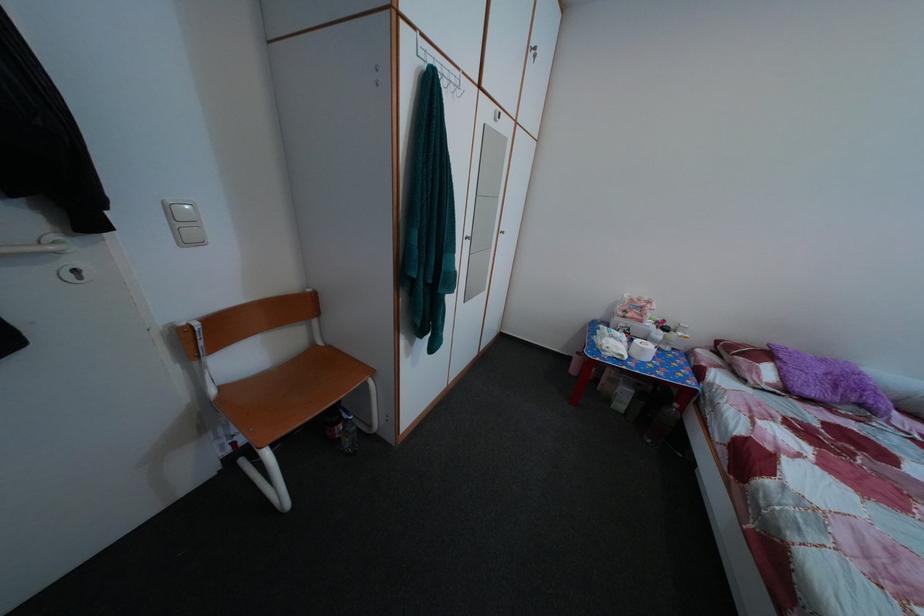
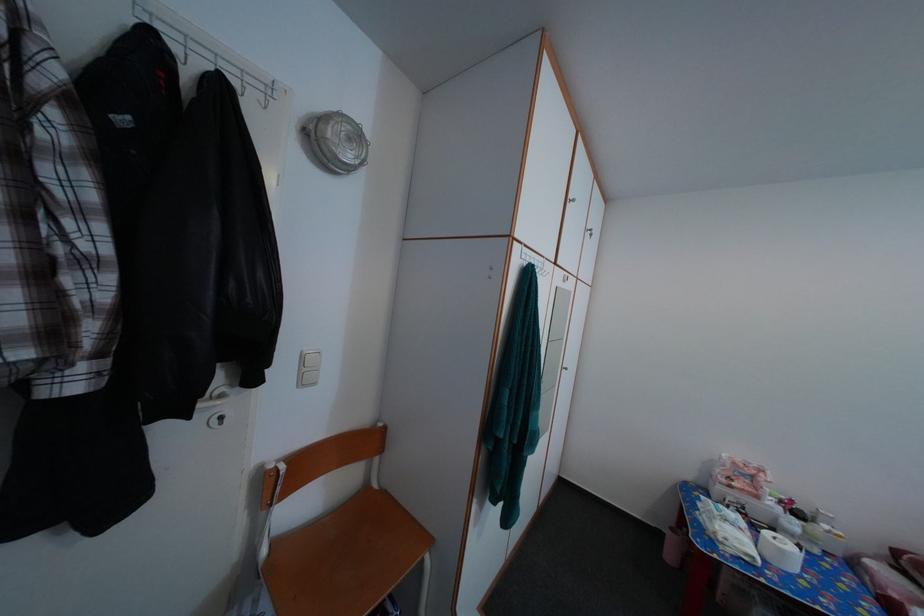
The point at (411, 31) is marked in the first image. Where is the corresponding point in the second image?

(525, 251)